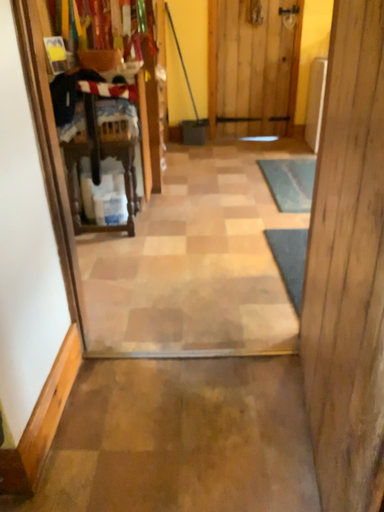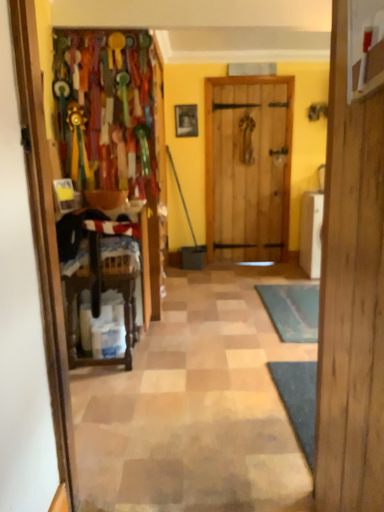
Question: Which way did the camera rotate in the video?

Choices:
 (A) rotated upward
 (B) rotated downward

Answer: (A)